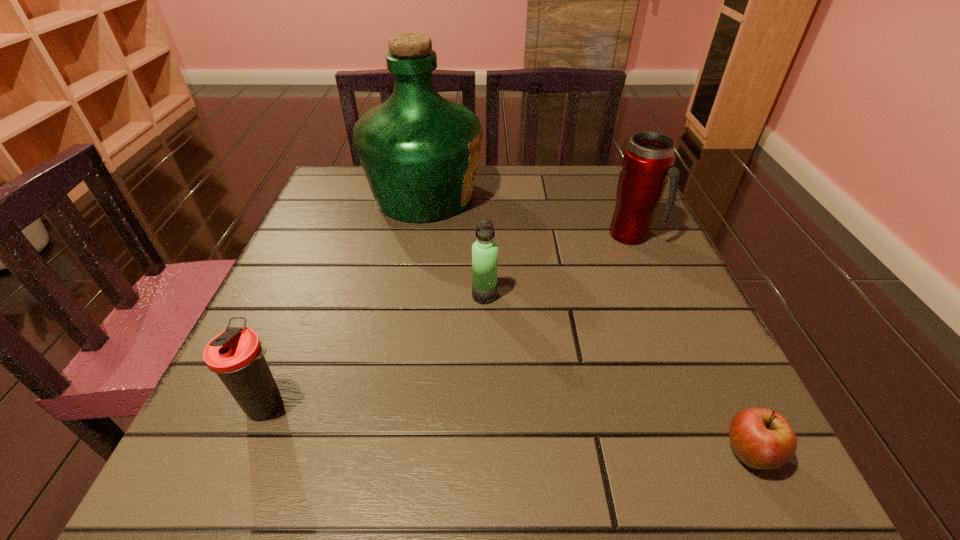
Identify the location of the tallest object. (419, 151).

The image size is (960, 540). In order to click on the rightmost thermos bottle in this screenshot , I will do `click(647, 162)`.

This screenshot has width=960, height=540. I want to click on the tallest thermos bottle, so click(647, 162).

Locate an element on the screen. This screenshot has height=540, width=960. the third farthest object is located at coordinates (484, 251).

Find the location of a particular element. The width and height of the screenshot is (960, 540). the second thermos bottle from right to left is located at coordinates (484, 251).

Where is `the second nearest object`? The height and width of the screenshot is (540, 960). the second nearest object is located at coordinates (236, 355).

This screenshot has width=960, height=540. Find the location of `the leftmost thermos bottle`. the leftmost thermos bottle is located at coordinates (236, 355).

This screenshot has width=960, height=540. I want to click on apple, so click(x=761, y=438).

You are a GUI agent. You are given a task and a screenshot of the screen. Output one action in this format:
    pyautogui.click(x=<x>, y=<y>)
    Task: Click on the nearest object
    
    Given the screenshot: What is the action you would take?
    pyautogui.click(x=761, y=438)

Where is `vacant space situated on the label side of the tallest object`? vacant space situated on the label side of the tallest object is located at coordinates (x=568, y=196).